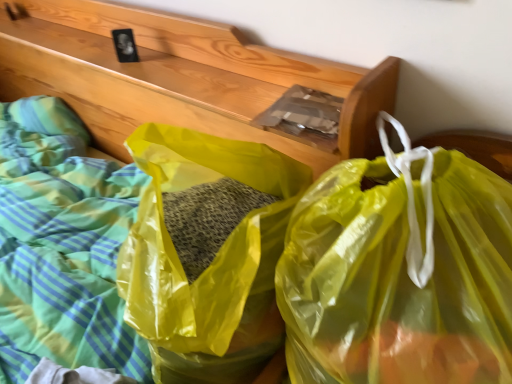
Question: Which direction should I rotate to look at yellow translucent plastic bag at center, acting as the first plastic bag starting from the left, — up or down?

Choices:
 (A) down
 (B) up

Answer: (A)

Question: Can you confirm if translucent yellow plastic bag at center, marked as the first plastic bag in a right-to-left arrangement, is positioned to the left of yellow translucent plastic bag at center, acting as the first plastic bag starting from the left?

Choices:
 (A) yes
 (B) no

Answer: (B)

Question: Is translucent yellow plastic bag at center, which is the second plastic bag from left to right, positioned with its back to yellow translucent plastic bag at center, acting as the first plastic bag starting from the left?

Choices:
 (A) yes
 (B) no

Answer: (B)

Question: Does translucent yellow plastic bag at center, which is the second plastic bag from left to right, come behind yellow translucent plastic bag at center, acting as the first plastic bag starting from the left?

Choices:
 (A) yes
 (B) no

Answer: (B)

Question: From the image's perspective, would you say translucent yellow plastic bag at center, which is the second plastic bag from left to right, is positioned over yellow translucent plastic bag at center, the 2th plastic bag from the right?

Choices:
 (A) yes
 (B) no

Answer: (B)

Question: Considering the relative positions of translucent yellow plastic bag at center, which is the second plastic bag from left to right, and yellow translucent plastic bag at center, acting as the first plastic bag starting from the left, in the image provided, is translucent yellow plastic bag at center, which is the second plastic bag from left to right, in front of yellow translucent plastic bag at center, acting as the first plastic bag starting from the left,?

Choices:
 (A) yes
 (B) no

Answer: (A)

Question: Considering the relative sizes of translucent yellow plastic bag at center, which is the second plastic bag from left to right, and yellow translucent plastic bag at center, acting as the first plastic bag starting from the left, in the image provided, is translucent yellow plastic bag at center, which is the second plastic bag from left to right, smaller than yellow translucent plastic bag at center, acting as the first plastic bag starting from the left,?

Choices:
 (A) no
 (B) yes

Answer: (B)

Question: Can you confirm if yellow translucent plastic bag at center, the 2th plastic bag from the right, is taller than translucent yellow plastic bag at center, which is the second plastic bag from left to right?

Choices:
 (A) yes
 (B) no

Answer: (B)

Question: Would you say yellow translucent plastic bag at center, acting as the first plastic bag starting from the left, is a long distance from translucent yellow plastic bag at center, which is the second plastic bag from left to right?

Choices:
 (A) yes
 (B) no

Answer: (B)

Question: Does yellow translucent plastic bag at center, the 2th plastic bag from the right, have a greater width compared to translucent yellow plastic bag at center, which is the second plastic bag from left to right?

Choices:
 (A) no
 (B) yes

Answer: (B)

Question: From the image's perspective, is yellow translucent plastic bag at center, the 2th plastic bag from the right, under translucent yellow plastic bag at center, which is the second plastic bag from left to right?

Choices:
 (A) yes
 (B) no

Answer: (B)

Question: Is yellow translucent plastic bag at center, acting as the first plastic bag starting from the left, positioned beyond the bounds of translucent yellow plastic bag at center, which is the second plastic bag from left to right?

Choices:
 (A) yes
 (B) no

Answer: (A)

Question: From the image's perspective, is yellow translucent plastic bag at center, the 2th plastic bag from the right, located above translucent yellow plastic bag at center, marked as the first plastic bag in a right-to-left arrangement?

Choices:
 (A) no
 (B) yes

Answer: (B)

Question: Visually, is translucent yellow plastic bag at center, which is the second plastic bag from left to right, positioned to the left or to the right of yellow translucent plastic bag at center, the 2th plastic bag from the right?

Choices:
 (A) right
 (B) left

Answer: (A)